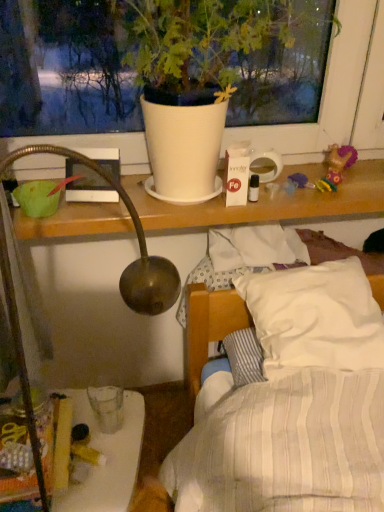
What is the approximate height of translucent plastic glass at lower left?

14.91 inches.

The image size is (384, 512). What do you see at coordinates (110, 451) in the screenshot?
I see `translucent plastic glass at lower left` at bounding box center [110, 451].

Image resolution: width=384 pixels, height=512 pixels. Identify the location of white matte pot at upper center. (197, 74).

The width and height of the screenshot is (384, 512). What are the coordinates of `translucent plastic glass at lower left` in the screenshot? It's located at pyautogui.click(x=110, y=451).

Is white matte pot at upper center at the right side of plush purple doll at upper right?

No.

Does white matte pot at upper center have a lesser height compared to plush purple doll at upper right?

No.

Find the location of a particular element. The image size is (384, 512). toy below the white matte pot at upper center (from the image's perspective) is located at coordinates (336, 166).

Is white matte pot at upper center not close to plush purple doll at upper right?

No.

Is translucent plastic glass at lower left aimed at plush purple doll at upper right?

No, translucent plastic glass at lower left is not facing towards plush purple doll at upper right.

Is translucent plastic glass at lower left placed right next to plush purple doll at upper right?

They are not placed beside each other.

From the image's perspective, is translucent plastic glass at lower left on top of plush purple doll at upper right?

Actually, translucent plastic glass at lower left appears below plush purple doll at upper right in the image.

Considering the sizes of objects white matte pot at upper center and translucent plastic glass at lower left in the image provided, who is wider, white matte pot at upper center or translucent plastic glass at lower left?

With larger width is white matte pot at upper center.

Can you confirm if white matte pot at upper center is positioned to the left of translucent plastic glass at lower left?

In fact, white matte pot at upper center is to the right of translucent plastic glass at lower left.

The height and width of the screenshot is (512, 384). In the image, there is a translucent plastic glass at lower left. What are the coordinates of `houseplant above it (from the image's perspective)` in the screenshot? It's located at (197, 74).

From a real-world perspective, is white matte pot at upper center over translucent plastic glass at lower left?

Yes, from a real-world perspective, white matte pot at upper center is above translucent plastic glass at lower left.

In the scene shown: Which of these two, plush purple doll at upper right or white matte pot at upper center, is bigger?

With larger size is white matte pot at upper center.

Is plush purple doll at upper right surrounding white matte pot at upper center?

No, plush purple doll at upper right does not contain white matte pot at upper center.

Considering the relative sizes of plush purple doll at upper right and white matte pot at upper center in the image provided, is plush purple doll at upper right shorter than white matte pot at upper center?

Yes.

Which is farther, (349, 155) or (224, 64)?

The point (349, 155) is behind.

In terms of height, does translucent plastic glass at lower left look taller or shorter compared to white matte pot at upper center?

In the image, translucent plastic glass at lower left appears to be shorter than white matte pot at upper center.

Is translucent plastic glass at lower left in front of white matte pot at upper center?

That is False.

From the image's perspective, is translucent plastic glass at lower left located above or below white matte pot at upper center?

Clearly, from the image's perspective, translucent plastic glass at lower left is below white matte pot at upper center.

Does translucent plastic glass at lower left touch white matte pot at upper center?

No, translucent plastic glass at lower left is not beside white matte pot at upper center.

Considering the sizes of objects plush purple doll at upper right and translucent plastic glass at lower left in the image provided, who is wider, plush purple doll at upper right or translucent plastic glass at lower left?

Wider between the two is translucent plastic glass at lower left.

Is plush purple doll at upper right at the left side of translucent plastic glass at lower left?

No.

Measure the distance between plush purple doll at upper right and translucent plastic glass at lower left.

33.11 inches.

Would you say plush purple doll at upper right is inside or outside translucent plastic glass at lower left?

plush purple doll at upper right is outside translucent plastic glass at lower left.

This screenshot has height=512, width=384. I want to click on toy below the white matte pot at upper center (from a real-world perspective), so click(x=336, y=166).

You are a GUI agent. You are given a task and a screenshot of the screen. Output one action in this format:
    pyautogui.click(x=<x>, y=<y>)
    Task: Click on the furniture on the left of plush purple doll at upper right
    The image size is (384, 512).
    Given the screenshot: What is the action you would take?
    pyautogui.click(x=110, y=451)

When comparing their distances from white matte pot at upper center, does translucent plastic glass at lower left or plush purple doll at upper right seem further?

Based on the image, translucent plastic glass at lower left appears to be further to white matte pot at upper center.

From the picture: Looking at the image, which one is located further to plush purple doll at upper right, white matte pot at upper center or translucent plastic glass at lower left?

translucent plastic glass at lower left is positioned further to the anchor plush purple doll at upper right.

Which object lies nearer to the anchor point translucent plastic glass at lower left, plush purple doll at upper right or white matte pot at upper center?

Based on the image, white matte pot at upper center appears to be nearer to translucent plastic glass at lower left.

From the image, which object appears to be farther from white matte pot at upper center, plush purple doll at upper right or translucent plastic glass at lower left?

translucent plastic glass at lower left is further to white matte pot at upper center.

Estimate the real-world distances between objects in this image. Which object is closer to plush purple doll at upper right, translucent plastic glass at lower left or white matte pot at upper center?

white matte pot at upper center is positioned closer to the anchor plush purple doll at upper right.

Which object lies further to the anchor point translucent plastic glass at lower left, white matte pot at upper center or plush purple doll at upper right?

The object further to translucent plastic glass at lower left is plush purple doll at upper right.

Find the location of a particular element. Image resolution: width=384 pixels, height=512 pixels. toy between white matte pot at upper center and translucent plastic glass at lower left from top to bottom is located at coordinates (336, 166).